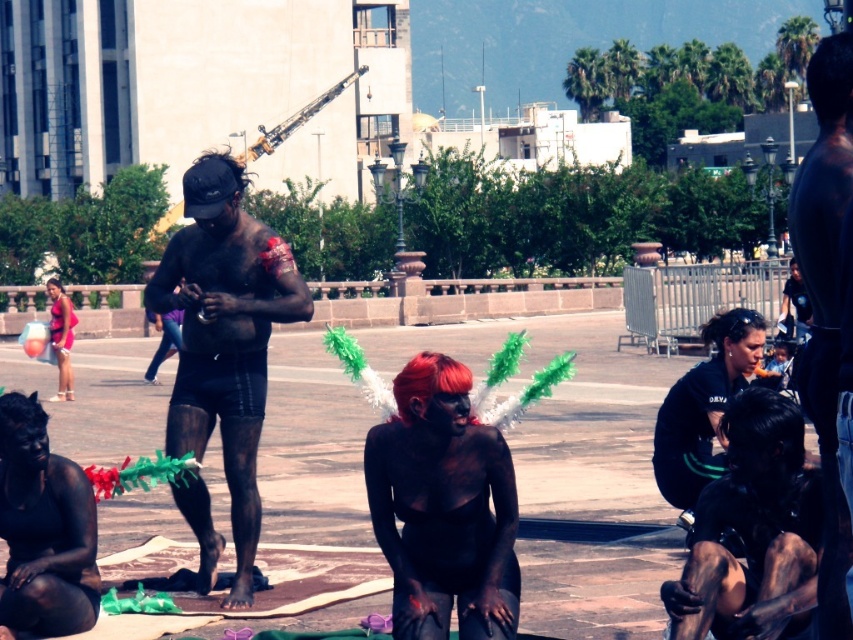
In the scene shown: You are standing at the center of the plaza and see two points marked in the image. The first point is at coordinates point (224,355) and the second is at point (419,394). Which point is closer to you?

Point (419,394) is closer to you because it is in front of point (224,355).

You are a photographer trying to capture the scene from the front. You need to ensure both the black matte body paint at lower left and the black matte uniform at center are visible in your frame. Based on their positions, which one should you focus on first to include both in the shot?

The black matte body paint at lower left is positioned on the left side of black matte uniform at center. To include both in the frame, focus on the black matte body paint at lower left first, then adjust to include the black matte uniform at center on the right side.